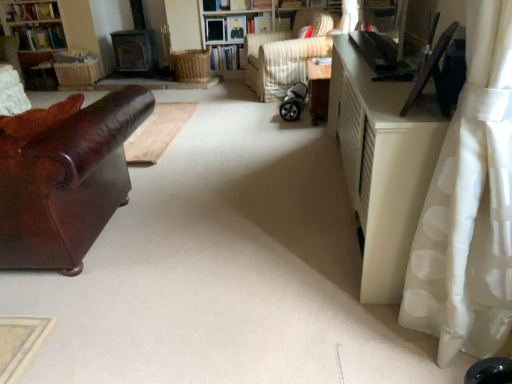
Question: Is wooden bookshelf at center turned away from shiny brown leather couch at left?

Choices:
 (A) yes
 (B) no

Answer: (B)

Question: Considering the relative positions of wooden bookshelf at center and shiny brown leather couch at left in the image provided, is wooden bookshelf at center to the right of shiny brown leather couch at left from the viewer's perspective?

Choices:
 (A) yes
 (B) no

Answer: (A)

Question: Does wooden bookshelf at center have a lesser width compared to shiny brown leather couch at left?

Choices:
 (A) no
 (B) yes

Answer: (B)

Question: Is wooden bookshelf at center far from shiny brown leather couch at left?

Choices:
 (A) yes
 (B) no

Answer: (A)

Question: Does wooden bookshelf at center lie in front of shiny brown leather couch at left?

Choices:
 (A) no
 (B) yes

Answer: (A)

Question: Choose the correct answer: Is woven wicker bookshelf at upper left inside white matte cabinet at right or outside it?

Choices:
 (A) inside
 (B) outside

Answer: (B)

Question: Is woven wicker bookshelf at upper left in front of or behind white matte cabinet at right in the image?

Choices:
 (A) front
 (B) behind

Answer: (B)

Question: Considering the positions of woven wicker bookshelf at upper left and white matte cabinet at right in the image, is woven wicker bookshelf at upper left bigger or smaller than white matte cabinet at right?

Choices:
 (A) small
 (B) big

Answer: (A)

Question: From their relative heights in the image, would you say woven wicker bookshelf at upper left is taller or shorter than white matte cabinet at right?

Choices:
 (A) short
 (B) tall

Answer: (B)

Question: Is white polka dot fabric at right wider or thinner than striped fabric chair at center?

Choices:
 (A) wide
 (B) thin

Answer: (B)

Question: Is white polka dot fabric at right inside the boundaries of striped fabric chair at center, or outside?

Choices:
 (A) inside
 (B) outside

Answer: (B)

Question: Is point (458, 253) closer or farther from the camera than point (318, 41)?

Choices:
 (A) farther
 (B) closer

Answer: (B)

Question: Based on their positions, is white polka dot fabric at right located to the left or right of striped fabric chair at center?

Choices:
 (A) right
 (B) left

Answer: (A)

Question: From a real-world perspective, is silver metallic baby carriage at center physically located above or below shiny brown leather couch at left?

Choices:
 (A) below
 (B) above

Answer: (A)

Question: Would you say silver metallic baby carriage at center is to the left or to the right of shiny brown leather couch at left in the picture?

Choices:
 (A) left
 (B) right

Answer: (B)